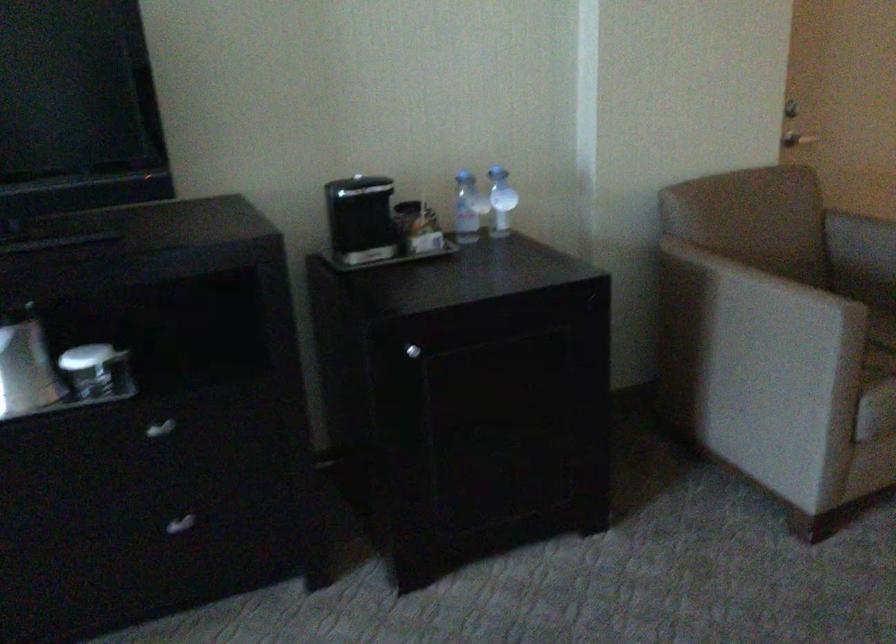
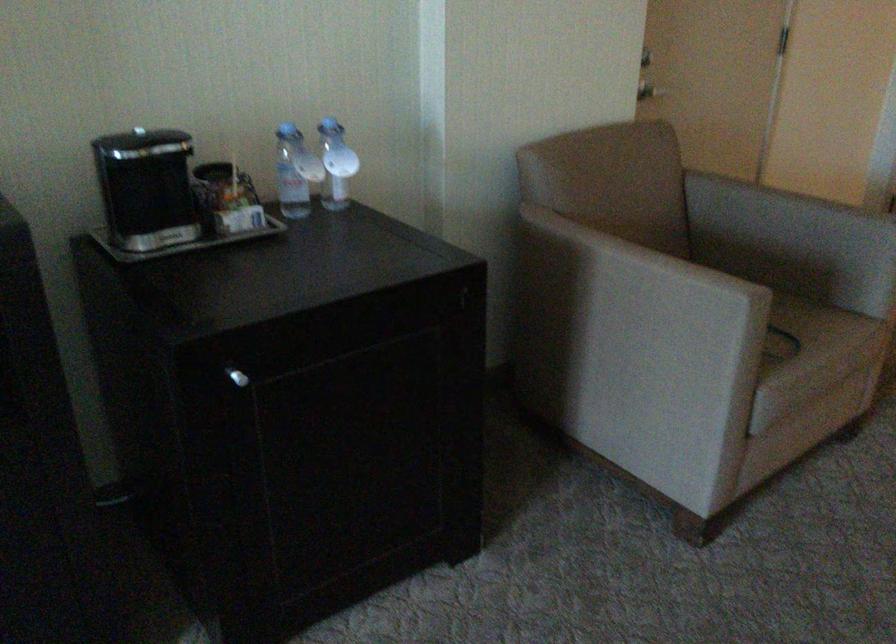
In the second image, find the point that corresponds to the point at 409,205 in the first image.

(212, 171)